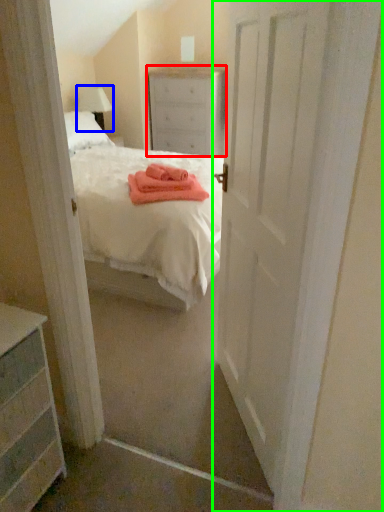
Question: Which is farther away from nightstand (highlighted by a red box)? lamp (highlighted by a blue box) or door (highlighted by a green box)?

Choices:
 (A) lamp
 (B) door

Answer: (B)